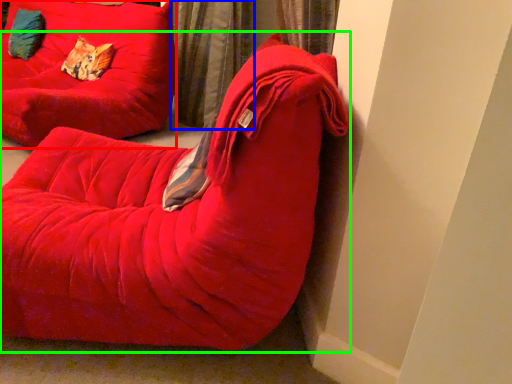
Question: Which object is the closest to the furniture (highlighted by a red box)? Choose among these: curtain (highlighted by a blue box) or furniture (highlighted by a green box).

Choices:
 (A) curtain
 (B) furniture

Answer: (A)